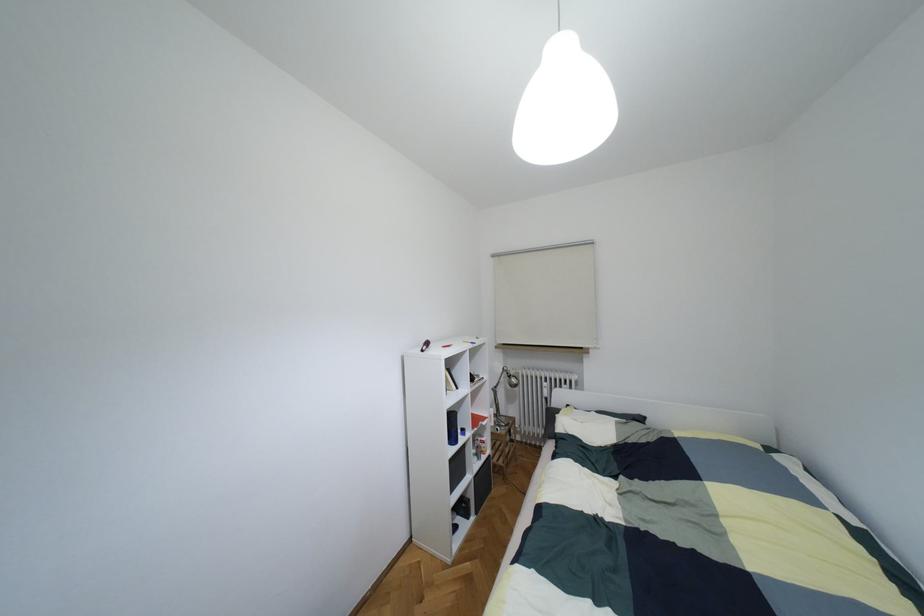
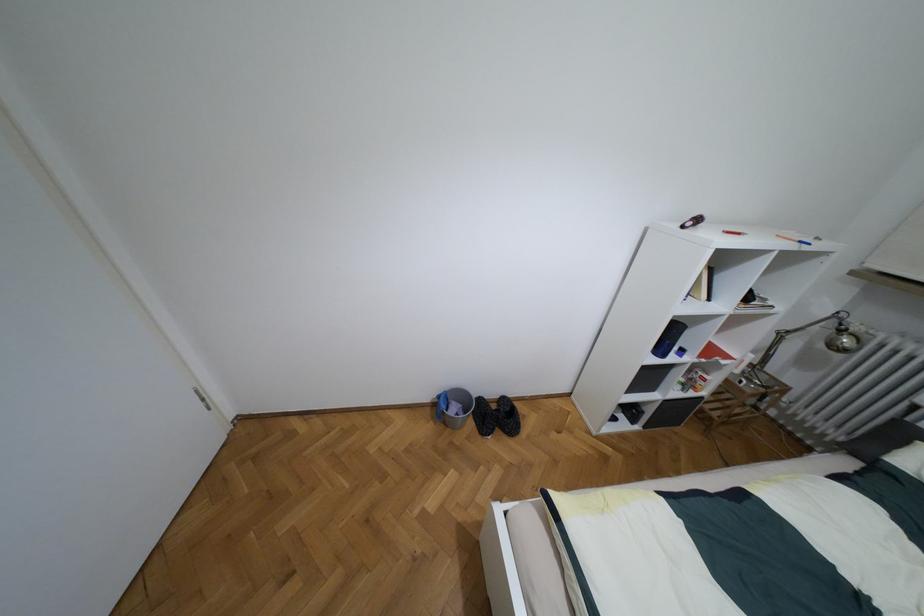
Locate, in the second image, the point that corresponds to pixel 508 376 in the first image.

(840, 330)